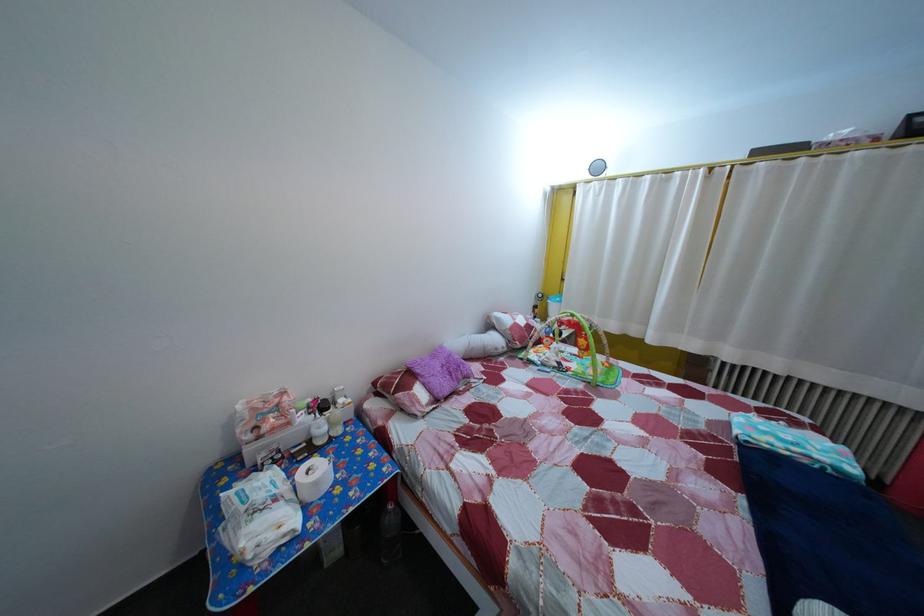
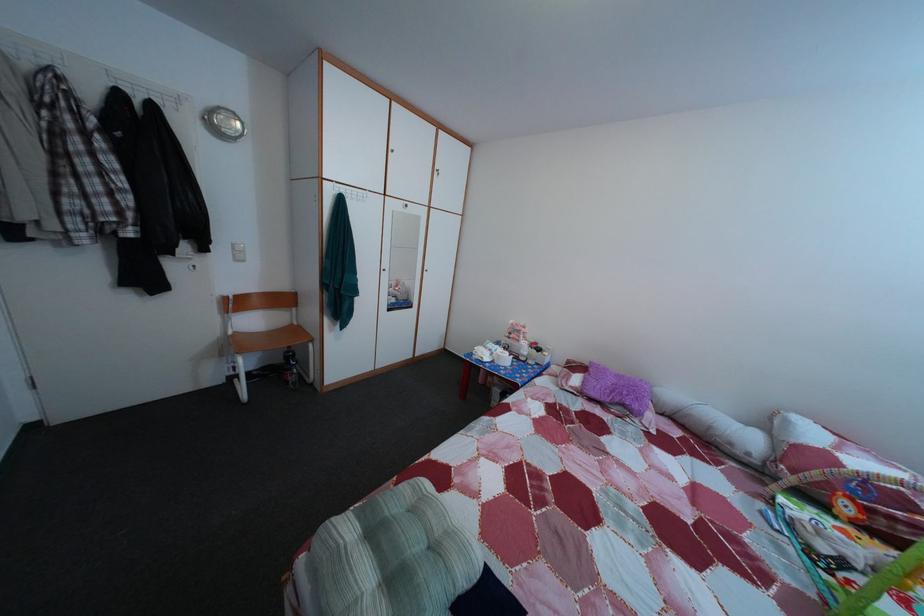
Where in the second image is the point corresponding to (298,432) from the first image?

(528, 349)